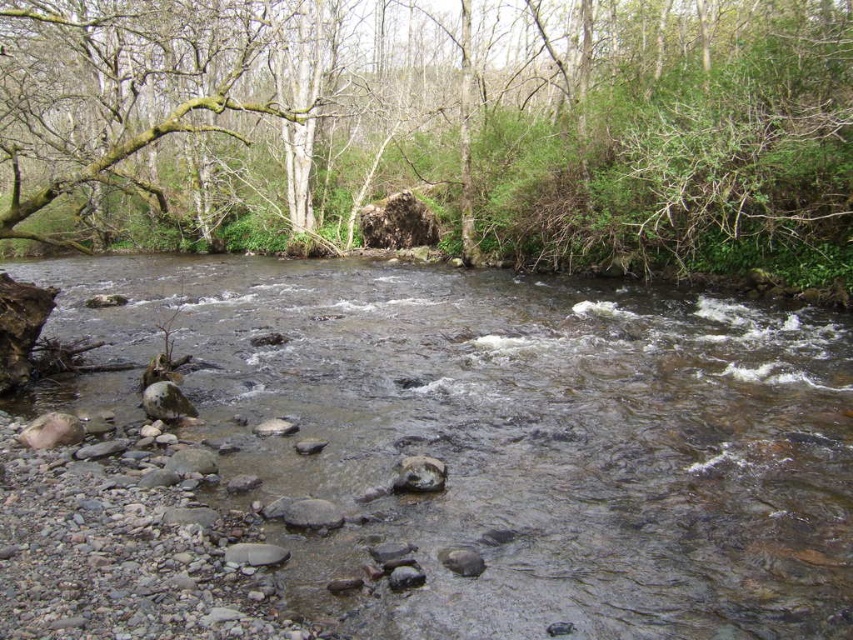
You are a hiker trying to cross the river at the scene. You see the clear water at center and the gray smooth rock at center. Which object should you step on first to start your crossing?

You should step on the gray smooth rock at center first because the clear water at center is to the right of it, meaning the rock is positioned to the left and closer to your starting point.

You are a hiker who wants to cross the river using the gray smooth rock at center as a stepping stone. The green leafy tree at upper center is blocking your path. Can you estimate how far you need to walk around the tree to reach the rock?

The green leafy tree at upper center is 23.85 meters away from the gray smooth rock at center. To reach the rock, you would need to walk around the tree, covering a distance of approximately 23.85 meters.

You are standing at the edge of the river and want to cross to the other side. The clear water at center flows beneath the green leafy tree at upper center. Which direction should you head to avoid the strongest current?

The clear water at center is below the green leafy tree at upper center, so heading away from the direction of the green leafy tree at upper center would help avoid the strongest current.